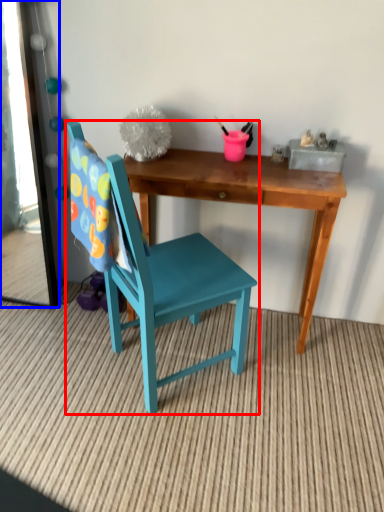
Question: Among these objects, which one is farthest to the camera, chair (highlighted by a red box) or mirror (highlighted by a blue box)?

Choices:
 (A) chair
 (B) mirror

Answer: (B)